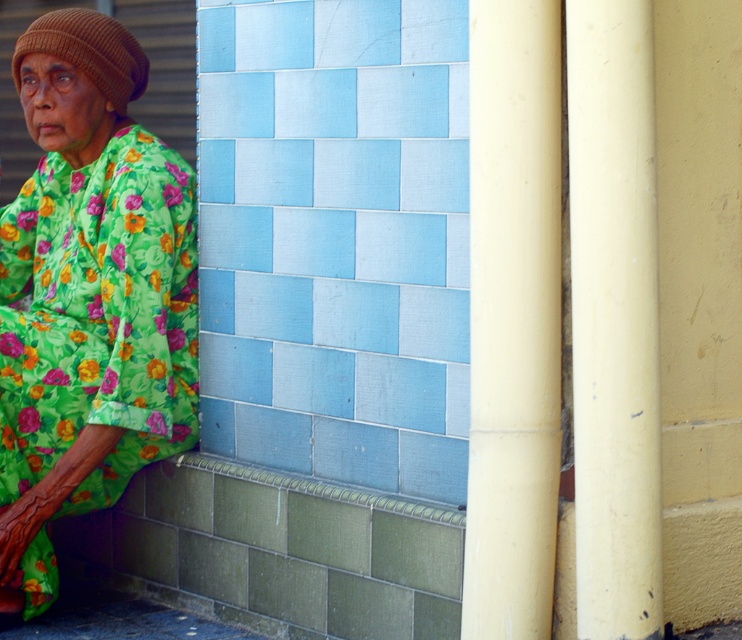
Question: Does green floral dress at left appear under brown knitted hat at upper left?

Choices:
 (A) yes
 (B) no

Answer: (A)

Question: Which point is closer to the camera?

Choices:
 (A) (65, 29)
 (B) (298, 490)
 (C) (91, 13)
 (D) (640, 182)

Answer: (D)

Question: Which point is closer to the camera?

Choices:
 (A) green floral dress at left
 (B) green textured curb at lower left
 (C) brown knitted hat at upper left

Answer: (B)

Question: Which of the following is the farthest from the observer?

Choices:
 (A) (512, 410)
 (B) (137, 429)
 (C) (111, 35)
 (D) (628, 506)

Answer: (C)

Question: Does smooth yellow pillar at right appear under smooth cream-colored pillar at right?

Choices:
 (A) no
 (B) yes

Answer: (B)

Question: Does green floral dress at left have a lesser width compared to brown knitted hat at upper left?

Choices:
 (A) no
 (B) yes

Answer: (A)